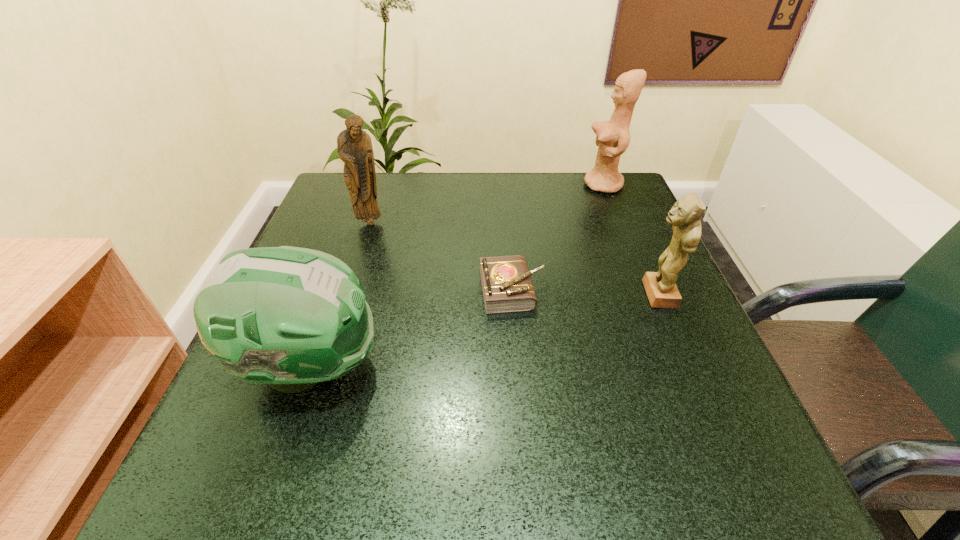
Locate an element on the screen. Image resolution: width=960 pixels, height=540 pixels. vacant area situated on the front-facing side of the second farthest object is located at coordinates (325, 362).

The image size is (960, 540). What are the coordinates of `free point located on the visor of the football helmet` in the screenshot? It's located at (x=510, y=367).

This screenshot has height=540, width=960. I want to click on vacant space located on the front-facing side of the shortest figurine, so click(x=531, y=295).

I want to click on vacant region located 0.140m on the front-facing side of the shortest figurine, so click(x=567, y=295).

This screenshot has width=960, height=540. I want to click on free region located 0.250m on the front-facing side of the shortest figurine, so click(x=510, y=295).

Find the location of a particular element. This screenshot has height=540, width=960. free region located on the front of the diary is located at coordinates (516, 340).

In order to click on figurine situated at the left edge in this screenshot , I will do `click(354, 146)`.

Identify the location of football helmet that is at the left edge. Image resolution: width=960 pixels, height=540 pixels. (290, 317).

This screenshot has width=960, height=540. I want to click on object that is at the far left corner, so 354,146.

Where is `object situated at the far right corner`? This screenshot has width=960, height=540. object situated at the far right corner is located at coordinates (613, 137).